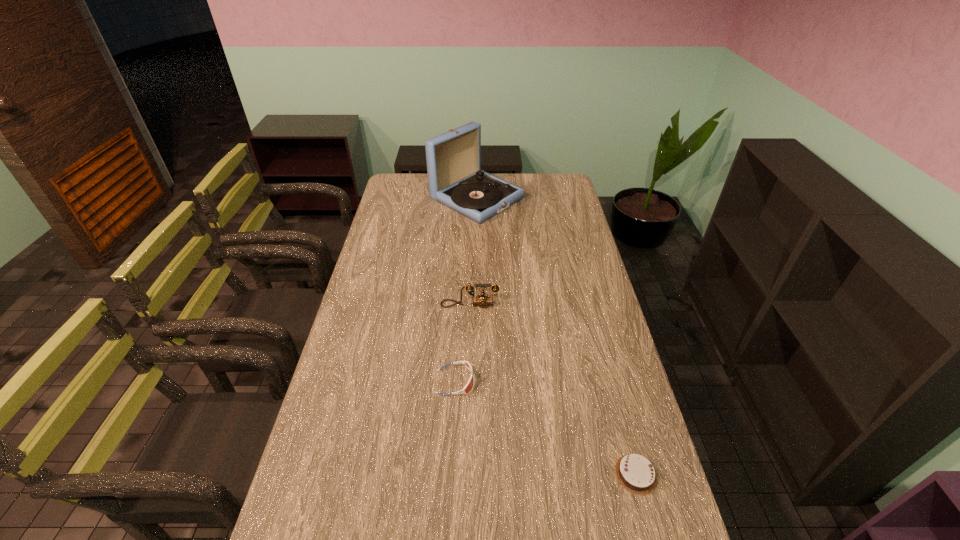
What are the coordinates of `vacant space situated 0.370m on the front-facing side of the second nearest object` in the screenshot? It's located at click(599, 382).

You are a GUI agent. You are given a task and a screenshot of the screen. Output one action in this format:
    pyautogui.click(x=<x>, y=<y>)
    Task: Click on the vacant area situated 0.090m on the left of the nearest object
    
    Given the screenshot: What is the action you would take?
    pyautogui.click(x=579, y=474)

At what (x,y) coordinates should I click in order to perform the action: click on object present at the far edge. Please return your answer as a coordinate pair (x, y). This screenshot has width=960, height=540. Looking at the image, I should click on (455, 179).

Find the location of a particular element. The width and height of the screenshot is (960, 540). object at the right edge is located at coordinates (635, 473).

Find the location of a particular element. vacant area at the left edge of the desktop is located at coordinates (368, 291).

Where is `vacant space at the right edge of the desktop`? The width and height of the screenshot is (960, 540). vacant space at the right edge of the desktop is located at coordinates (582, 237).

Where is `free space between the rightmost object and the tallest object`? The height and width of the screenshot is (540, 960). free space between the rightmost object and the tallest object is located at coordinates (556, 336).

In order to click on vacant area that lies between the second nearest object and the farthest object in this screenshot , I will do `click(466, 290)`.

Image resolution: width=960 pixels, height=540 pixels. In order to click on vacant area between the farthest object and the third farthest object in this screenshot , I will do `click(466, 290)`.

This screenshot has width=960, height=540. Identify the location of free spot between the second nearest object and the telephone. (463, 343).